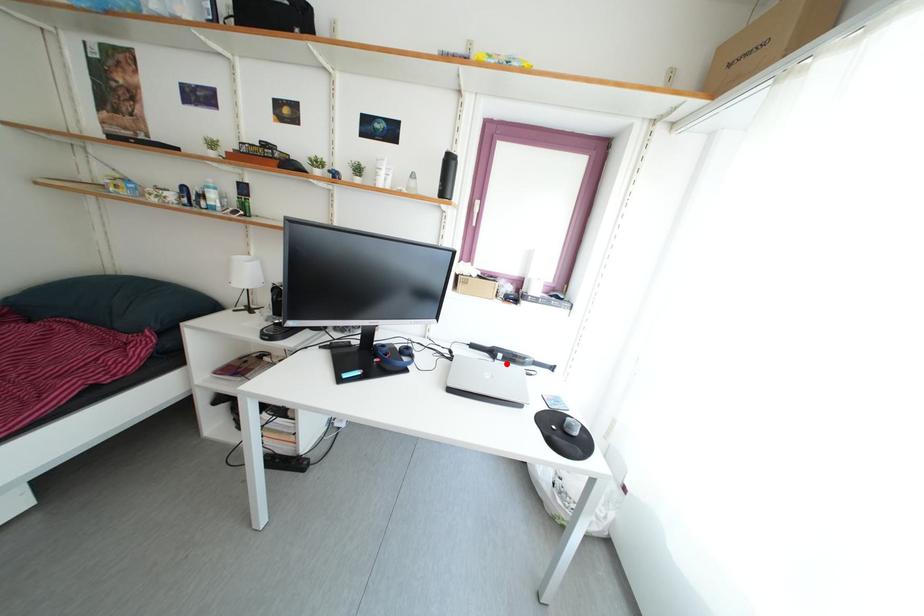
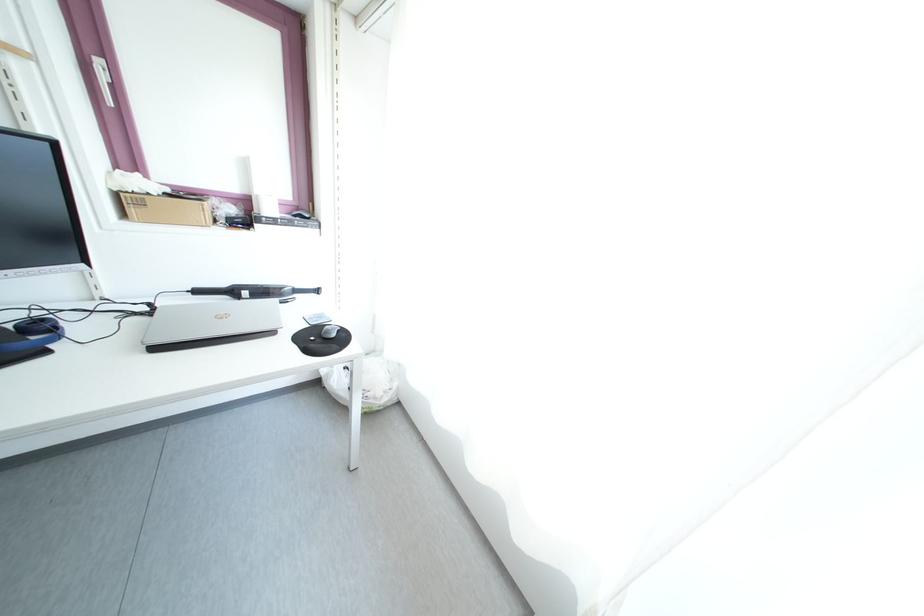
In the second image, find the point that corresponds to the highlighted location in the first image.

(251, 302)